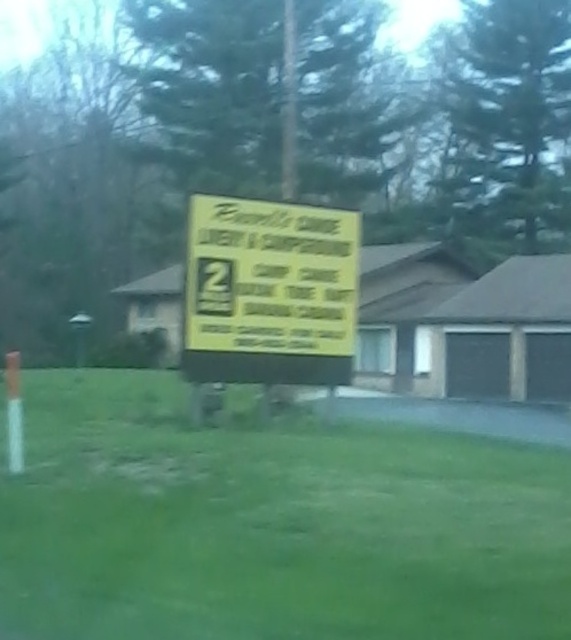
You are a gardener who wants to place a new flower pot in the garden. The flower pot needs to be placed in an area where the green grass at center is shorter than the yellow paper sign at center. Based on the image, is the area at the center suitable for placing the flower pot?

Yes, the area at the center is suitable because the green grass at center has a lesser height compared to the yellow paper sign at center, meeting the requirement for placing the flower pot.

You are a delivery person trying to reach the house at the back. The yellow paper sign at center has instructions for deliveries. Can you see the sign while standing on the green grass at center?

The green grass at center is in front of the yellow paper sign at center, so if you are standing on the green grass at center, you would be closer to the viewer than the sign. Therefore, you can see the yellow paper sign at center from that position.